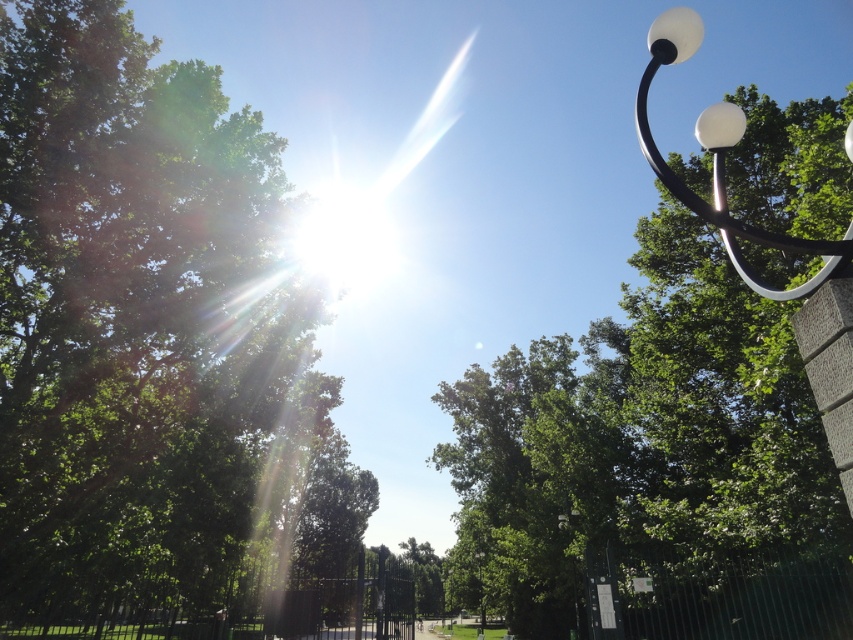
Question: Which point is closer to the camera taking this photo?

Choices:
 (A) (660, 156)
 (B) (149, 45)
 (C) (544, 417)

Answer: (A)

Question: Among these objects, which one is farthest from the camera?

Choices:
 (A) green leafy tree at upper left
 (B) green leafy tree at upper center
 (C) white glossy lamp post at upper right

Answer: (A)

Question: Is green leafy tree at upper left in front of green leafy tree at upper center?

Choices:
 (A) no
 (B) yes

Answer: (A)

Question: Does green leafy tree at upper left have a lesser width compared to white glossy lamp post at upper right?

Choices:
 (A) no
 (B) yes

Answer: (A)

Question: Which of these objects is positioned farthest from the white glossy lamp post at upper right?

Choices:
 (A) green leafy tree at upper left
 (B) green leafy tree at upper center

Answer: (B)

Question: Does green leafy tree at upper left come in front of white glossy lamp post at upper right?

Choices:
 (A) yes
 (B) no

Answer: (B)